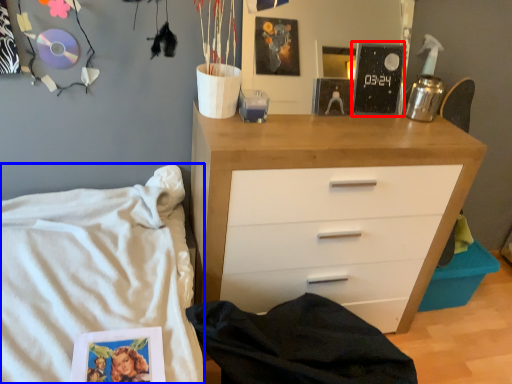
Question: Which object is further to the camera taking this photo, magazine (highlighted by a red box) or bed (highlighted by a blue box)?

Choices:
 (A) magazine
 (B) bed

Answer: (A)